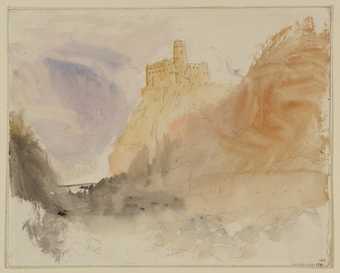
This screenshot has width=340, height=273. I want to click on upper part of paining, so click(x=133, y=22).